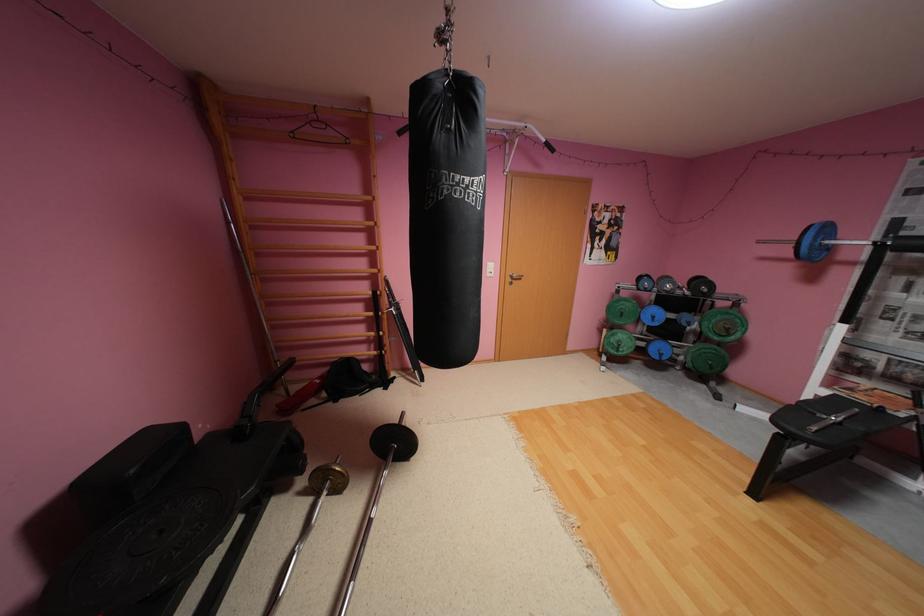
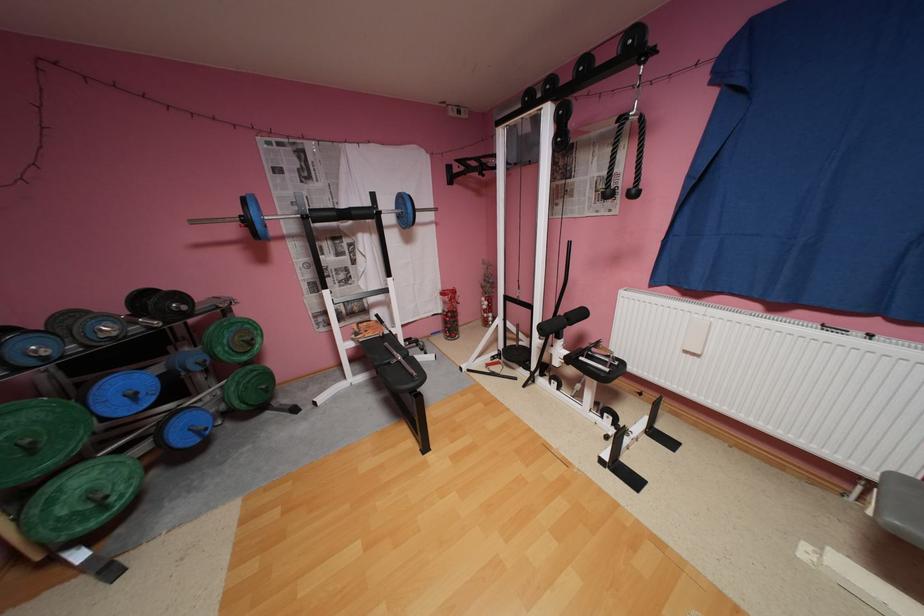
Locate, in the second image, the point that corresponds to point (870, 399) in the first image.

(380, 334)